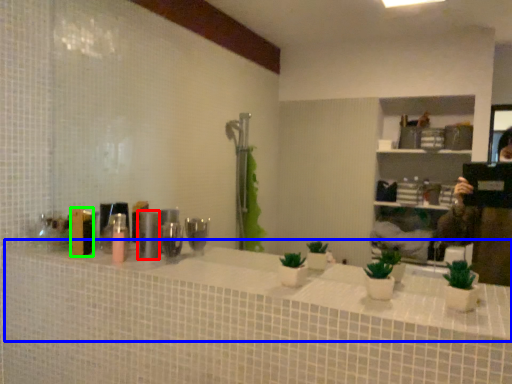
Question: Considering the real-world distances, which object is farthest from toiletry (highlighted by a red box)? counter top (highlighted by a blue box) or toiletry (highlighted by a green box)?

Choices:
 (A) counter top
 (B) toiletry

Answer: (A)